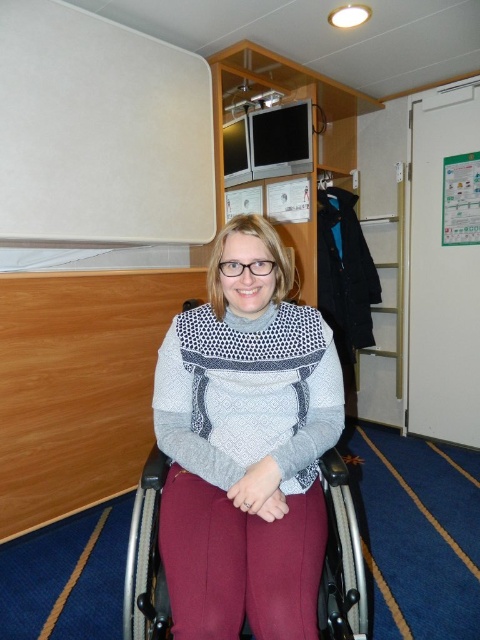
Question: Which object is positioned closest to the maroon leggings at center?

Choices:
 (A) knitted sweater at center
 (B) knitted gray sweater at center

Answer: (A)

Question: Which of the following is the closest to the observer?

Choices:
 (A) (370, 324)
 (B) (275, 529)

Answer: (B)

Question: Is the position of knitted gray sweater at center more distant than that of maroon leggings at center?

Choices:
 (A) no
 (B) yes

Answer: (B)

Question: Does maroon leggings at center appear under knitted wool sweater at center?

Choices:
 (A) yes
 (B) no

Answer: (A)

Question: Is maroon leggings at center below knitted wool sweater at center?

Choices:
 (A) yes
 (B) no

Answer: (A)

Question: Which point is farther to the camera?

Choices:
 (A) (355, 253)
 (B) (192, 589)
 (C) (247, 464)
 (D) (228, 349)

Answer: (A)